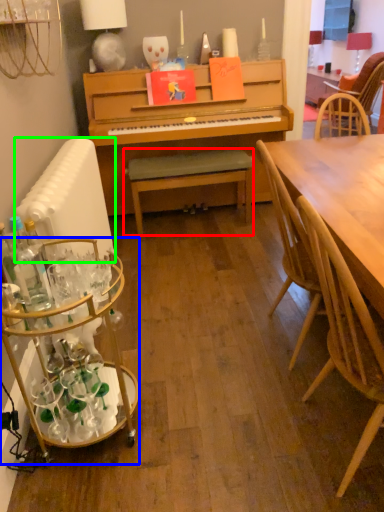
Question: Based on their relative distances, which object is farther from bench (highlighted by a red box)? Choose from desk (highlighted by a blue box) and radiator (highlighted by a green box).

Choices:
 (A) desk
 (B) radiator

Answer: (A)